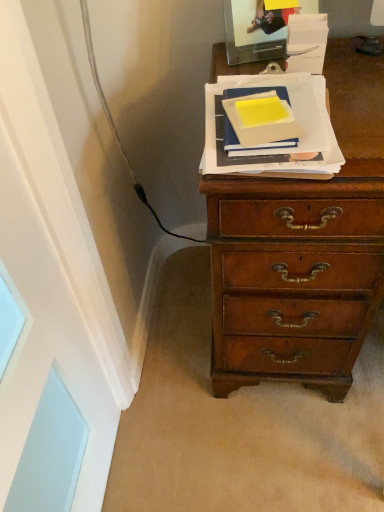
The height and width of the screenshot is (512, 384). Describe the element at coordinates (288, 148) in the screenshot. I see `blue matte book at center, which is the first paperback book from right to left` at that location.

I want to click on blue matte book at center, the second paperback book viewed from the left, so [288, 148].

At what (x,y) coordinates should I click in order to perform the action: click on matte yellow paper at upper center, placed as the first paperback book when sorted from left to right. Please return your answer as a coordinate pair (x, y). Looking at the image, I should click on (258, 118).

What do you see at coordinates (258, 118) in the screenshot?
I see `matte yellow paper at upper center, the second paperback book positioned from the right` at bounding box center [258, 118].

Find the location of a particular element. The width and height of the screenshot is (384, 512). blue matte book at center, which is the first paperback book from right to left is located at coordinates (288, 148).

Which object is positioned more to the right, blue matte book at center, which is the first paperback book from right to left, or matte yellow paper at upper center, the second paperback book positioned from the right?

blue matte book at center, which is the first paperback book from right to left.

Is the depth of blue matte book at center, which is the first paperback book from right to left, less than that of matte yellow paper at upper center, placed as the first paperback book when sorted from left to right?

That is True.

Does point (307, 93) appear closer or farther from the camera than point (285, 128)?

Clearly, point (307, 93) is more distant from the camera than point (285, 128).

Consider the image. From the image's perspective, which one is positioned higher, blue matte book at center, which is the first paperback book from right to left, or matte yellow paper at upper center, the second paperback book positioned from the right?

matte yellow paper at upper center, the second paperback book positioned from the right.

From a real-world perspective, is blue matte book at center, the second paperback book viewed from the left, physically above matte yellow paper at upper center, the second paperback book positioned from the right?

No.

Considering the relative sizes of blue matte book at center, the second paperback book viewed from the left, and matte yellow paper at upper center, placed as the first paperback book when sorted from left to right, in the image provided, is blue matte book at center, the second paperback book viewed from the left, thinner than matte yellow paper at upper center, placed as the first paperback book when sorted from left to right,?

In fact, blue matte book at center, the second paperback book viewed from the left, might be wider than matte yellow paper at upper center, placed as the first paperback book when sorted from left to right.

Can you confirm if blue matte book at center, which is the first paperback book from right to left, is shorter than matte yellow paper at upper center, the second paperback book positioned from the right?

Yes, blue matte book at center, which is the first paperback book from right to left, is shorter than matte yellow paper at upper center, the second paperback book positioned from the right.

Does blue matte book at center, the second paperback book viewed from the left, have a larger size compared to matte yellow paper at upper center, placed as the first paperback book when sorted from left to right?

Indeed, blue matte book at center, the second paperback book viewed from the left, has a larger size compared to matte yellow paper at upper center, placed as the first paperback book when sorted from left to right.

Does blue matte book at center, which is the first paperback book from right to left, contain matte yellow paper at upper center, placed as the first paperback book when sorted from left to right?

No, matte yellow paper at upper center, placed as the first paperback book when sorted from left to right, is not inside blue matte book at center, which is the first paperback book from right to left.

Is blue matte book at center, which is the first paperback book from right to left, not close to matte yellow paper at upper center, placed as the first paperback book when sorted from left to right?

No, blue matte book at center, which is the first paperback book from right to left, is not far away from matte yellow paper at upper center, placed as the first paperback book when sorted from left to right.

Is blue matte book at center, which is the first paperback book from right to left, oriented away from matte yellow paper at upper center, the second paperback book positioned from the right?

No.

How different are the orientations of blue matte book at center, which is the first paperback book from right to left, and matte yellow paper at upper center, placed as the first paperback book when sorted from left to right, in degrees?

They differ by 2.02 degrees in their facing directions.

The height and width of the screenshot is (512, 384). In order to click on paperback book below the matte yellow paper at upper center, the second paperback book positioned from the right (from the image's perspective) in this screenshot , I will do `click(288, 148)`.

Which is more to the left, matte yellow paper at upper center, placed as the first paperback book when sorted from left to right, or blue matte book at center, the second paperback book viewed from the left?

matte yellow paper at upper center, placed as the first paperback book when sorted from left to right, is more to the left.

Who is more distant, matte yellow paper at upper center, the second paperback book positioned from the right, or blue matte book at center, the second paperback book viewed from the left?

matte yellow paper at upper center, the second paperback book positioned from the right, is behind.

Which is closer to the camera, (241, 141) or (316, 160)?

Point (241, 141) is positioned farther from the camera compared to point (316, 160).

From the image's perspective, between matte yellow paper at upper center, the second paperback book positioned from the right, and blue matte book at center, the second paperback book viewed from the left, who is located below?

blue matte book at center, the second paperback book viewed from the left.

From a real-world perspective, is matte yellow paper at upper center, the second paperback book positioned from the right, located beneath blue matte book at center, which is the first paperback book from right to left?

Actually, matte yellow paper at upper center, the second paperback book positioned from the right, is physically above blue matte book at center, which is the first paperback book from right to left, in the real world.

Based on the photo, which object is thinner, matte yellow paper at upper center, the second paperback book positioned from the right, or blue matte book at center, which is the first paperback book from right to left?

matte yellow paper at upper center, the second paperback book positioned from the right.

Based on the photo, considering the relative sizes of matte yellow paper at upper center, the second paperback book positioned from the right, and blue matte book at center, which is the first paperback book from right to left, in the image provided, is matte yellow paper at upper center, the second paperback book positioned from the right, taller than blue matte book at center, which is the first paperback book from right to left,?

Yes, matte yellow paper at upper center, the second paperback book positioned from the right, is taller than blue matte book at center, which is the first paperback book from right to left.

Considering the relative sizes of matte yellow paper at upper center, placed as the first paperback book when sorted from left to right, and blue matte book at center, which is the first paperback book from right to left, in the image provided, is matte yellow paper at upper center, placed as the first paperback book when sorted from left to right, bigger than blue matte book at center, which is the first paperback book from right to left,?

No.

Would you say blue matte book at center, the second paperback book viewed from the left, is part of matte yellow paper at upper center, placed as the first paperback book when sorted from left to right,'s contents?

No, blue matte book at center, the second paperback book viewed from the left, is not surrounded by matte yellow paper at upper center, placed as the first paperback book when sorted from left to right.

Are matte yellow paper at upper center, placed as the first paperback book when sorted from left to right, and blue matte book at center, the second paperback book viewed from the left, beside each other?

Indeed, matte yellow paper at upper center, placed as the first paperback book when sorted from left to right, and blue matte book at center, the second paperback book viewed from the left, are beside each other and touching.

Could you tell me if matte yellow paper at upper center, placed as the first paperback book when sorted from left to right, is turned towards blue matte book at center, which is the first paperback book from right to left?

No, matte yellow paper at upper center, placed as the first paperback book when sorted from left to right, does not turn towards blue matte book at center, which is the first paperback book from right to left.

Can you tell me how much matte yellow paper at upper center, placed as the first paperback book when sorted from left to right, and blue matte book at center, the second paperback book viewed from the left, differ in facing direction?

There is a 2.02-degree angle between the facing directions of matte yellow paper at upper center, placed as the first paperback book when sorted from left to right, and blue matte book at center, the second paperback book viewed from the left.

You are a GUI agent. You are given a task and a screenshot of the screen. Output one action in this format:
    pyautogui.click(x=<x>, y=<y>)
    Task: Click on the paperback book located in front of the matte yellow paper at upper center, the second paperback book positioned from the right
    The image size is (384, 512).
    Given the screenshot: What is the action you would take?
    pyautogui.click(x=288, y=148)

What are the coordinates of `paperback book that is behind the blue matte book at center, which is the first paperback book from right to left` in the screenshot? It's located at (258, 118).

Locate an element on the screen. paperback book located above the blue matte book at center, the second paperback book viewed from the left (from a real-world perspective) is located at coordinates [258, 118].